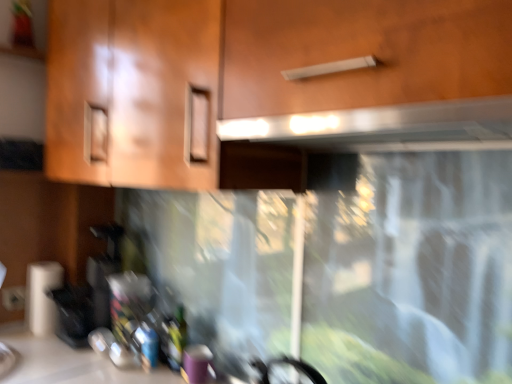
Question: Considering the relative sizes of satin silver exhaust hood at upper center and matte wood cabinet at upper center in the image provided, is satin silver exhaust hood at upper center shorter than matte wood cabinet at upper center?

Choices:
 (A) yes
 (B) no

Answer: (A)

Question: Is satin silver exhaust hood at upper center in front of matte wood cabinet at upper center?

Choices:
 (A) yes
 (B) no

Answer: (B)

Question: From a real-world perspective, is satin silver exhaust hood at upper center over matte wood cabinet at upper center?

Choices:
 (A) yes
 (B) no

Answer: (B)

Question: Is satin silver exhaust hood at upper center outside matte wood cabinet at upper center?

Choices:
 (A) yes
 (B) no

Answer: (B)

Question: Does satin silver exhaust hood at upper center have a smaller size compared to matte wood cabinet at upper center?

Choices:
 (A) yes
 (B) no

Answer: (A)

Question: Is satin silver exhaust hood at upper center not near matte wood cabinet at upper center?

Choices:
 (A) yes
 (B) no

Answer: (B)

Question: From a real-world perspective, is white plastic electric outlet at lower left beneath white matte paper towel at lower left?

Choices:
 (A) no
 (B) yes

Answer: (B)

Question: From the image's perspective, is white plastic electric outlet at lower left below white matte paper towel at lower left?

Choices:
 (A) no
 (B) yes

Answer: (B)

Question: Is there a large distance between white plastic electric outlet at lower left and white matte paper towel at lower left?

Choices:
 (A) yes
 (B) no

Answer: (B)

Question: Is white matte paper towel at lower left at the back of white plastic electric outlet at lower left?

Choices:
 (A) no
 (B) yes

Answer: (A)

Question: Are white plastic electric outlet at lower left and white matte paper towel at lower left making contact?

Choices:
 (A) yes
 (B) no

Answer: (B)

Question: Is white plastic electric outlet at lower left completely or partially outside of white matte paper towel at lower left?

Choices:
 (A) yes
 (B) no

Answer: (A)

Question: Is white plastic electric outlet at lower left behind matte wood cabinet at upper center?

Choices:
 (A) yes
 (B) no

Answer: (A)